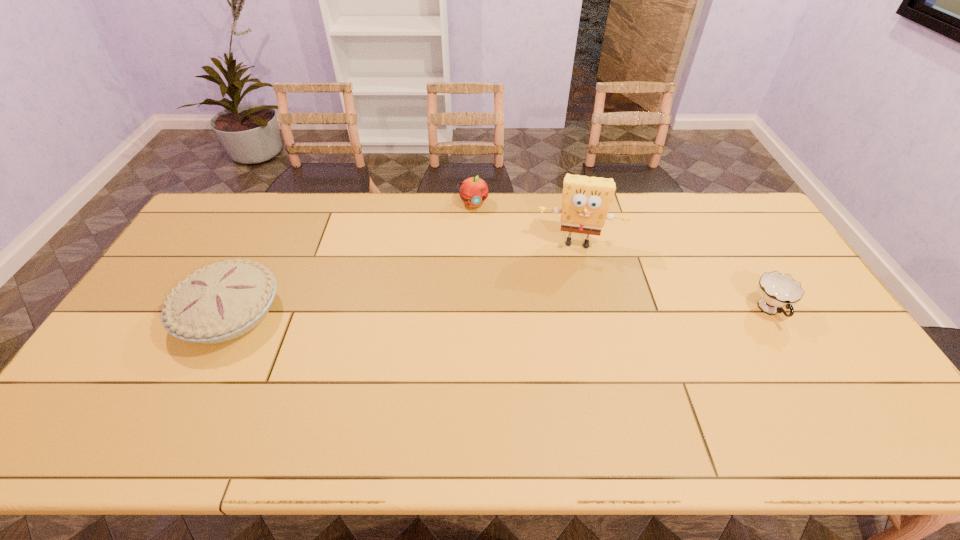
In the image, there is a desktop. Where is `blank space at the left edge`? This screenshot has width=960, height=540. blank space at the left edge is located at coordinates (144, 339).

Where is `vacant region at the right edge`? The image size is (960, 540). vacant region at the right edge is located at coordinates (763, 266).

I want to click on vacant space at the far left corner of the desktop, so click(x=213, y=211).

The height and width of the screenshot is (540, 960). In order to click on vacant area at the far right corner of the desktop in this screenshot , I will do `click(743, 196)`.

Identify the location of free space between the pie and the second farthest object. The width and height of the screenshot is (960, 540). (403, 278).

Locate an element on the screen. free space between the rightmost object and the sponge is located at coordinates (674, 276).

Where is `free space that is in between the third object from right to left and the second object from right to left`? free space that is in between the third object from right to left and the second object from right to left is located at coordinates (525, 222).

Locate an element on the screen. vacant area that lies between the third object from right to left and the pie is located at coordinates (351, 258).

I want to click on free spot between the pie and the rightmost object, so click(x=499, y=312).

Find the location of a particular element. Image resolution: width=960 pixels, height=540 pixels. empty space that is in between the rightmost object and the sponge is located at coordinates (674, 276).